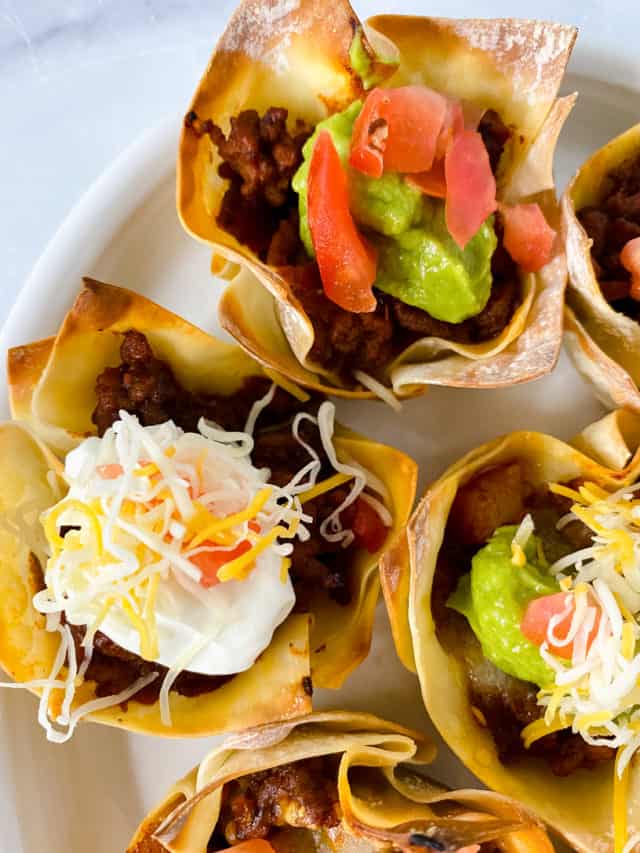
The width and height of the screenshot is (640, 853). Identify the location of plate. (153, 223).